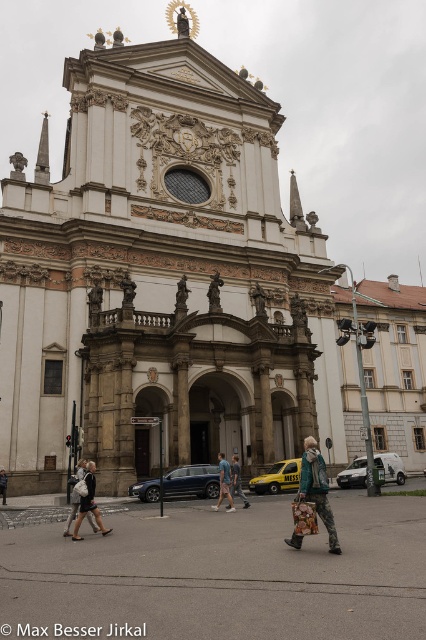
Who is more distant from viewer, (86, 472) or (249, 506)?

Point (249, 506)

Does black leather jacket at lower left have a greater width compared to denim jacket at center?

Yes, black leather jacket at lower left is wider than denim jacket at center.

What do you see at coordinates (89, 502) in the screenshot? The width and height of the screenshot is (426, 640). I see `black leather jacket at lower left` at bounding box center [89, 502].

Locate an element on the screen. black leather jacket at lower left is located at coordinates (89, 502).

Between white stone church at center and black leather jacket at lower left, which one is positioned higher?

white stone church at center is higher up.

Based on the photo, who is shorter, white stone church at center or black leather jacket at lower left?

With less height is black leather jacket at lower left.

The image size is (426, 640). I want to click on white stone church at center, so click(x=161, y=276).

Image resolution: width=426 pixels, height=640 pixels. I want to click on white stone church at center, so click(161, 276).

Between denim shorts at center and denim jacket at center, which one has more height?

Standing taller between the two is denim shorts at center.

Can you confirm if denim shorts at center is smaller than denim jacket at center?

Incorrect, denim shorts at center is not smaller in size than denim jacket at center.

Which is behind, point (222, 488) or point (232, 461)?

The point (232, 461) is more distant.

Identify the location of denim shorts at center. (224, 483).